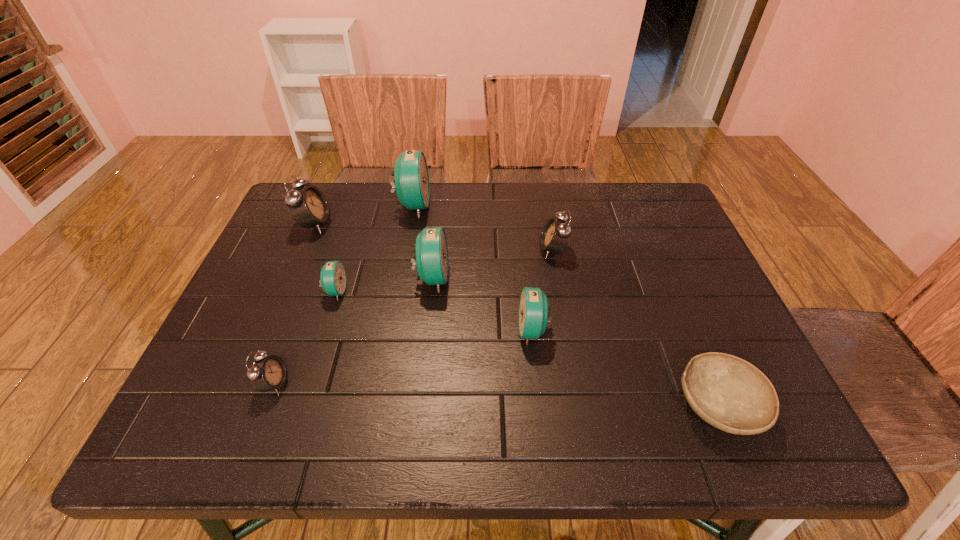
Identify the location of vacant region located on the front-facing side of the third biggest blue alarm clock. (460, 330).

Where is `vacant space situated 0.300m on the front-facing side of the third biggest blue alarm clock`? vacant space situated 0.300m on the front-facing side of the third biggest blue alarm clock is located at coordinates (383, 330).

Where is `vacant point located 0.270m on the front-facing side of the third biggest blue alarm clock`? The height and width of the screenshot is (540, 960). vacant point located 0.270m on the front-facing side of the third biggest blue alarm clock is located at coordinates (396, 330).

Where is `free space located on the front-facing side of the smallest blue alarm clock`? free space located on the front-facing side of the smallest blue alarm clock is located at coordinates (462, 291).

Image resolution: width=960 pixels, height=540 pixels. I want to click on free region located on the face of the nearest white alarm clock, so click(338, 384).

Where is `vacant point located 0.310m on the left of the gray bowl`? The height and width of the screenshot is (540, 960). vacant point located 0.310m on the left of the gray bowl is located at coordinates (515, 406).

Find the location of `object located in the near edge section of the desktop`. object located in the near edge section of the desktop is located at coordinates (729, 393).

Where is `object present at the right edge`? object present at the right edge is located at coordinates (729, 393).

I want to click on object located at the far left corner, so click(x=308, y=206).

At what (x,y) coordinates should I click in order to perform the action: click on object present at the near right corner. Please return your answer as a coordinate pair (x, y). This screenshot has width=960, height=540. Looking at the image, I should click on (729, 393).